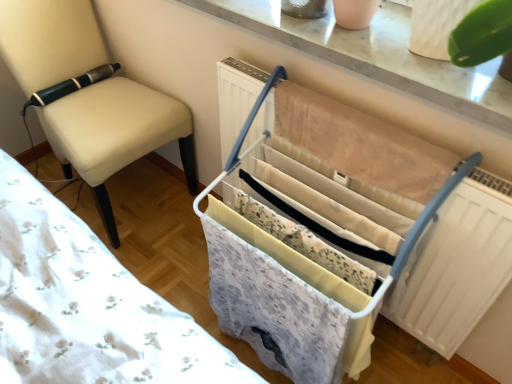
Find the location of a particular element. The width and height of the screenshot is (512, 384). beige fabric chair at left is located at coordinates (115, 134).

What do you see at coordinates (115, 134) in the screenshot?
I see `beige fabric chair at left` at bounding box center [115, 134].

What do you see at coordinates (317, 229) in the screenshot? I see `white plastic drying rack at center` at bounding box center [317, 229].

The image size is (512, 384). Identify the location of white plastic drying rack at center. (317, 229).

Measure the distance between white plastic drying rack at center and camera.

33.60 inches.

What are the coordinates of `beige fabric chair at left` in the screenshot? It's located at (115, 134).

Between white plastic drying rack at center and beige fabric chair at left, which one appears on the right side from the viewer's perspective?

white plastic drying rack at center is more to the right.

In the image, is white plastic drying rack at center positioned in front of or behind beige fabric chair at left?

Clearly, white plastic drying rack at center is in front of beige fabric chair at left.

Is point (461, 177) positioned behind point (15, 55)?

No, it is not.

From the image's perspective, would you say white plastic drying rack at center is shown under beige fabric chair at left?

Correct, white plastic drying rack at center appears lower than beige fabric chair at left in the image.

From a real-world perspective, between white plastic drying rack at center and beige fabric chair at left, who is vertically lower?

white plastic drying rack at center is physically lower.

In the scene shown: Between white plastic drying rack at center and beige fabric chair at left, which one has smaller width?

With smaller width is white plastic drying rack at center.

In terms of height, does white plastic drying rack at center look taller or shorter compared to beige fabric chair at left?

Clearly, white plastic drying rack at center is shorter compared to beige fabric chair at left.

Can you confirm if white plastic drying rack at center is bigger than beige fabric chair at left?

Actually, white plastic drying rack at center might be smaller than beige fabric chair at left.

Is white plastic drying rack at center inside the boundaries of beige fabric chair at left, or outside?

white plastic drying rack at center cannot be found inside beige fabric chair at left.

Is the surface of white plastic drying rack at center in direct contact with beige fabric chair at left?

No, white plastic drying rack at center is not touching beige fabric chair at left.

Could you tell me if white plastic drying rack at center is turned towards beige fabric chair at left?

No, white plastic drying rack at center is not aimed at beige fabric chair at left.

How many degrees apart are the facing directions of white plastic drying rack at center and beige fabric chair at left?

88 degrees.

How much distance is there between white plastic drying rack at center and beige fabric chair at left?

67.12 centimeters.

Locate an element on the screen. The image size is (512, 384). chair above the white plastic drying rack at center (from a real-world perspective) is located at coordinates (115, 134).

Visually, is beige fabric chair at left positioned to the left or to the right of white plastic drying rack at center?

From the image, it's evident that beige fabric chair at left is to the left of white plastic drying rack at center.

Which object is closer to the camera taking this photo, beige fabric chair at left or white plastic drying rack at center?

white plastic drying rack at center is more forward.

Is point (102, 154) closer to viewer compared to point (273, 106)?

No, it is not.

From the image's perspective, relative to white plastic drying rack at center, is beige fabric chair at left above or below?

Based on their image positions, beige fabric chair at left is located above white plastic drying rack at center.

From a real-world perspective, which is physically above, beige fabric chair at left or white plastic drying rack at center?

beige fabric chair at left is physically above.

From the picture: Which of these two, beige fabric chair at left or white plastic drying rack at center, is thinner?

With smaller width is white plastic drying rack at center.

Is beige fabric chair at left taller than white plastic drying rack at center?

Yes, beige fabric chair at left is taller than white plastic drying rack at center.

Based on their sizes in the image, would you say beige fabric chair at left is bigger or smaller than white plastic drying rack at center?

Considering their sizes, beige fabric chair at left takes up more space than white plastic drying rack at center.

In the scene shown: Is beige fabric chair at left spatially inside white plastic drying rack at center, or outside of it?

beige fabric chair at left is spatially situated outside white plastic drying rack at center.

Is beige fabric chair at left not close to white plastic drying rack at center?

No, there isn't a large distance between beige fabric chair at left and white plastic drying rack at center.

Is beige fabric chair at left looking in the opposite direction of white plastic drying rack at center?

No, beige fabric chair at left is not facing the opposite direction of white plastic drying rack at center.

Can you tell me how much beige fabric chair at left and white plastic drying rack at center differ in facing direction?

There is a 88-degree angle between the facing directions of beige fabric chair at left and white plastic drying rack at center.

In the image, there is a beige fabric chair at left. Identify the location of baby carriage below it (from the image's perspective). The image size is (512, 384). (317, 229).

The image size is (512, 384). Find the location of `baby carriage in front of the beige fabric chair at left`. baby carriage in front of the beige fabric chair at left is located at coordinates (317, 229).

You are a GUI agent. You are given a task and a screenshot of the screen. Output one action in this format:
    pyautogui.click(x=<x>, y=<y>)
    Task: Click on the chair on the left of white plastic drying rack at center
    The height and width of the screenshot is (384, 512).
    Given the screenshot: What is the action you would take?
    pyautogui.click(x=115, y=134)